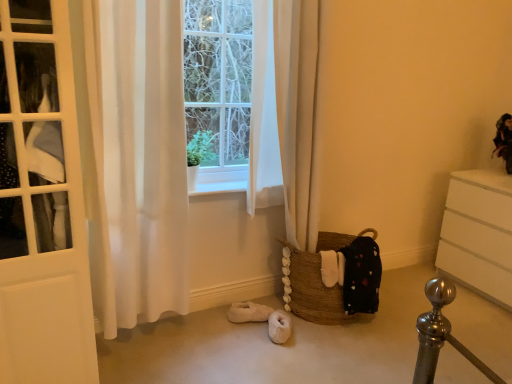
I want to click on free spot below white sheer curtain at left (from a real-world perspective), so click(x=156, y=340).